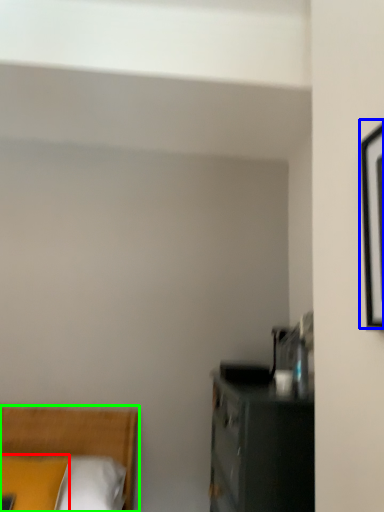
Question: Based on their relative distances, which object is nearer to pillow (highlighted by a red box)? Choose from picture frame (highlighted by a blue box) and bed (highlighted by a green box).

Choices:
 (A) picture frame
 (B) bed

Answer: (B)